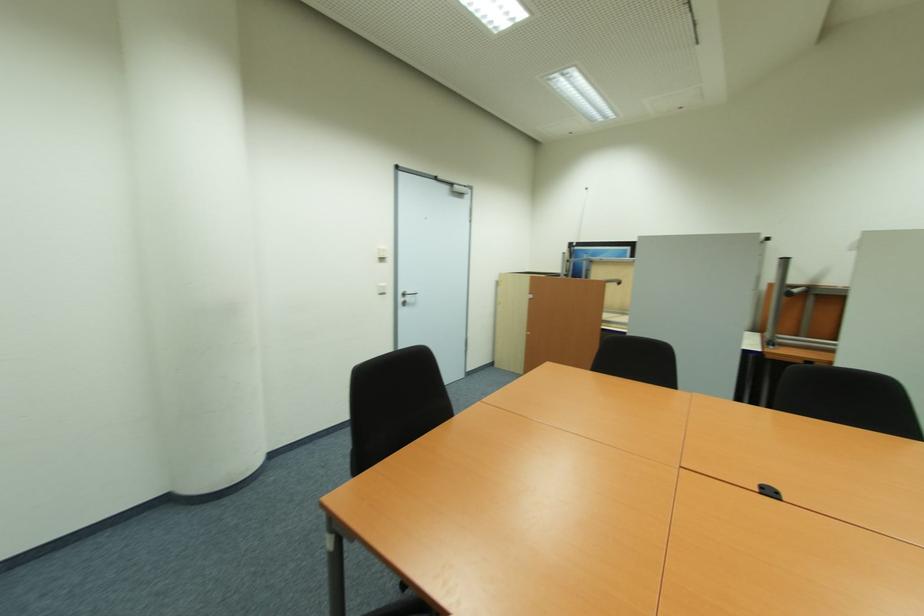
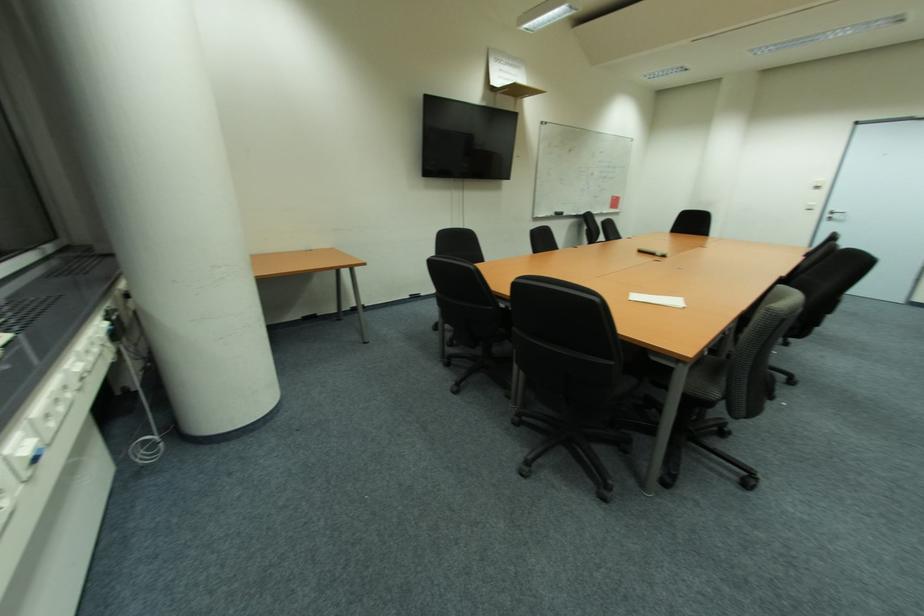
Locate, in the second image, the point that corresponds to point 381,260 in the first image.

(820, 188)